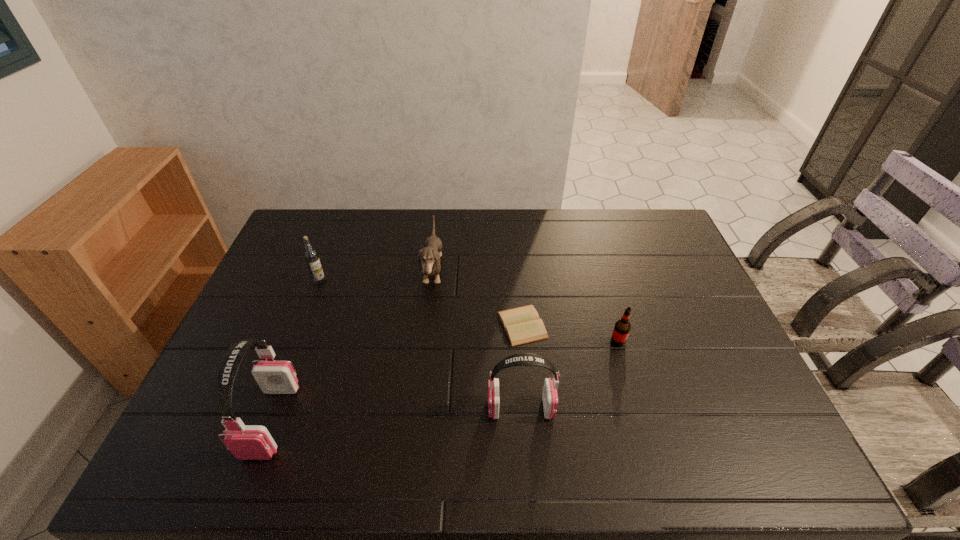
This screenshot has width=960, height=540. In the image, there is a desktop. What are the coordinates of `free region at the right edge` in the screenshot? It's located at (666, 287).

You are a GUI agent. You are given a task and a screenshot of the screen. Output one action in this format:
    pyautogui.click(x=<x>, y=<y>)
    Task: Click on the vacant space at the far right corner
    The height and width of the screenshot is (540, 960).
    Given the screenshot: What is the action you would take?
    pyautogui.click(x=632, y=216)

Locate an element on the screen. The height and width of the screenshot is (540, 960). empty location between the rightmost object and the shortest object is located at coordinates (570, 333).

The height and width of the screenshot is (540, 960). Identify the location of vacant space that's between the diary and the shorter earphone. (521, 367).

You are a GUI agent. You are given a task and a screenshot of the screen. Output one action in this format:
    pyautogui.click(x=<x>, y=<y>)
    Task: Click on the vacant area between the shortest object and the left earphone
    Image resolution: width=960 pixels, height=540 pixels.
    Given the screenshot: What is the action you would take?
    pyautogui.click(x=396, y=373)

Identify the location of free space between the vodka and the left earphone. (296, 351).

The height and width of the screenshot is (540, 960). What are the coordinates of `unoccupied position between the vodka and the shortest object` in the screenshot? It's located at (421, 303).

This screenshot has width=960, height=540. I want to click on unoccupied area between the shorter earphone and the vodka, so 420,345.

The height and width of the screenshot is (540, 960). In order to click on free space between the shortest object and the puppy in this screenshot , I will do `click(477, 298)`.

Locate an element on the screen. The height and width of the screenshot is (540, 960). free space between the shortest object and the tallest object is located at coordinates (396, 373).